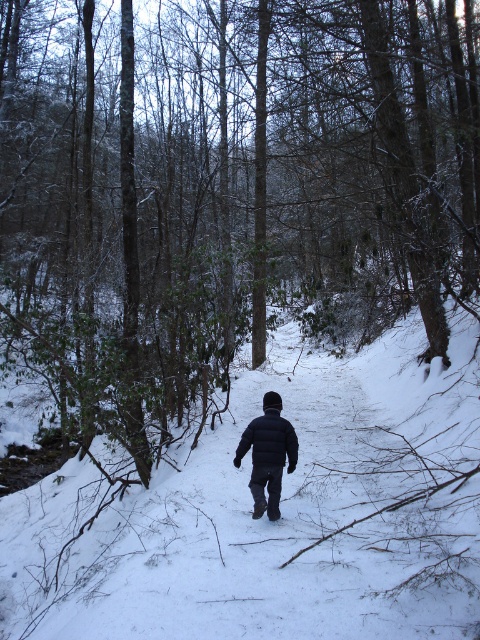
I want to click on white powdery snow at center, so click(280, 513).

Is point (74, 520) positioned in front of point (239, 452)?

No, (74, 520) is further to viewer.

What do you see at coordinates (280, 513) in the screenshot? The image size is (480, 640). I see `white powdery snow at center` at bounding box center [280, 513].

Image resolution: width=480 pixels, height=640 pixels. I want to click on white powdery snow at center, so click(x=280, y=513).

Between white powdery snow at center and matte black jacket at center, which one appears on the left side from the viewer's perspective?

From the viewer's perspective, matte black jacket at center appears more on the left side.

Identify the location of white powdery snow at center. (280, 513).

Is point (252, 456) less distant than point (267, 461)?

No, (252, 456) is further to viewer.

Is dark blue puffy jacket at center closer to camera compared to matte black jacket at center?

No, it is behind matte black jacket at center.

The image size is (480, 640). Describe the element at coordinates (267, 454) in the screenshot. I see `dark blue puffy jacket at center` at that location.

In order to click on dark blue puffy jacket at center in this screenshot , I will do `click(267, 454)`.